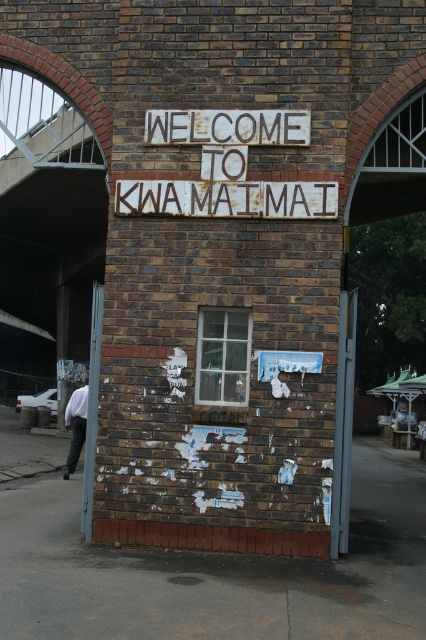
Question: Can you confirm if white painted wood sign at upper center is bigger than metallic gray door at left?

Choices:
 (A) no
 (B) yes

Answer: (A)

Question: Does metallic gray door at left have a larger size compared to white shirt at lower left?

Choices:
 (A) yes
 (B) no

Answer: (B)

Question: Which is farther from the white painted wood sign at upper center?

Choices:
 (A) white painted wood sign at center
 (B) white shirt at lower left

Answer: (B)

Question: Which object is farther from the camera taking this photo?

Choices:
 (A) white shirt at lower left
 (B) white painted wood sign at upper center

Answer: (A)

Question: From the image, what is the correct spatial relationship of white painted wood sign at center in relation to white shirt at lower left?

Choices:
 (A) above
 (B) below

Answer: (A)

Question: Which of the following is the farthest from the observer?

Choices:
 (A) (176, 198)
 (B) (249, 134)
 (C) (71, 426)
 (D) (92, 352)

Answer: (C)